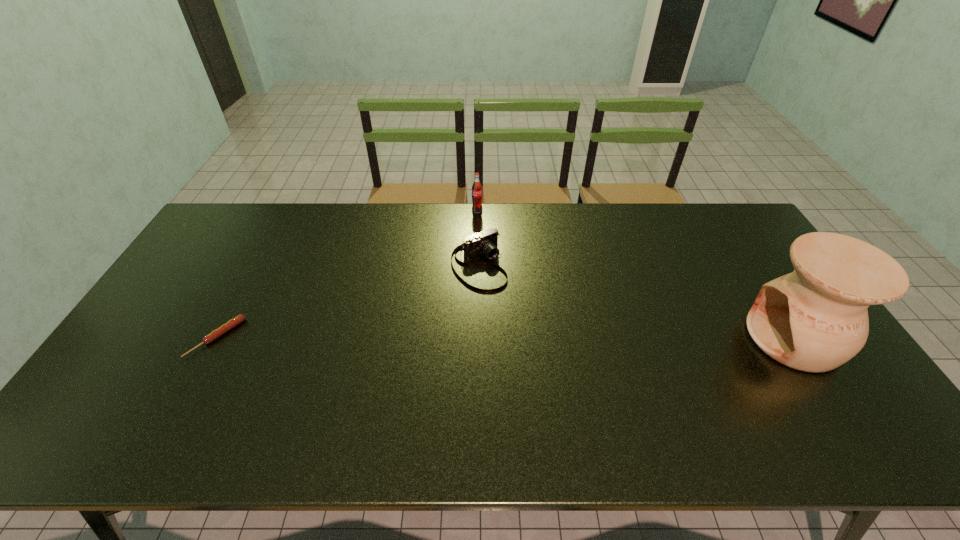
Identify the location of free space on the desktop that is between the shortest object and the pottery and is positioned on the label of the farthest object. This screenshot has height=540, width=960. (537, 338).

You are a GUI agent. You are given a task and a screenshot of the screen. Output one action in this format:
    pyautogui.click(x=<x>, y=<y>)
    Task: Click on the free spot on the desktop that is between the leftmost object and the pottery and is positioned on the front-facing side of the second shortest object
    Image resolution: width=960 pixels, height=540 pixels.
    Given the screenshot: What is the action you would take?
    pyautogui.click(x=541, y=338)